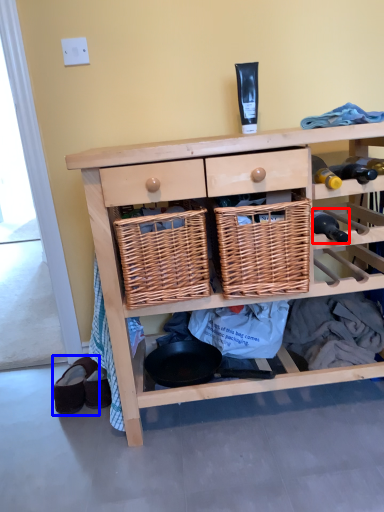
Question: Which point is further to the camera, bottle (highlighted by a red box) or footwear (highlighted by a blue box)?

Choices:
 (A) bottle
 (B) footwear

Answer: (B)